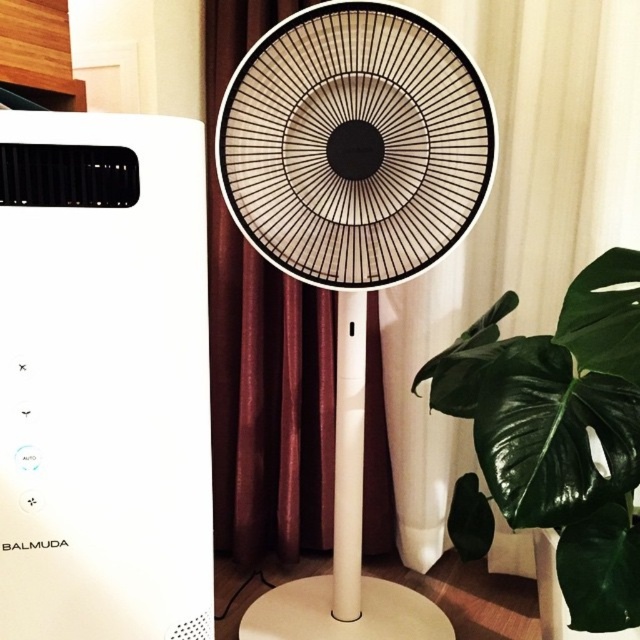
You are standing in a room with a black matte fan at center and a green matte leaf at lower right. If you want to place a small plant pot between them, which object should you move to make space?

The black matte fan at center is positioned over the green matte leaf at lower right, so you should move the black matte fan at center to create space between them for the plant pot.

You are standing in the room and want to place a small plant between the black matte fan at center and the green matte leaf at lower right. Which object should you place the plant closer to if you want it to be closer to the right wall?

You should place the plant closer to the green matte leaf at lower right because the black matte fan at center is positioned on the left side of the green matte leaf at lower right, meaning the leaf is closer to the right wall.